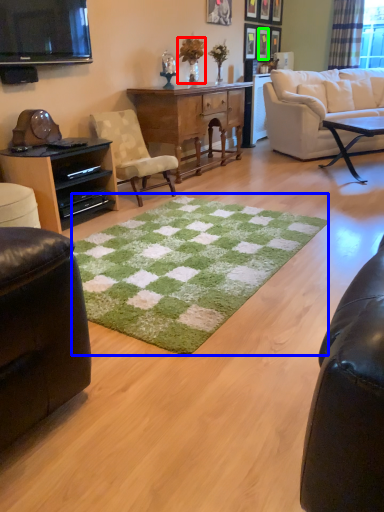
Question: Which object is positioned closest to houseplant (highlighted by a red box)? Select from mat (highlighted by a blue box) and picture frame (highlighted by a green box).

Choices:
 (A) mat
 (B) picture frame

Answer: (B)